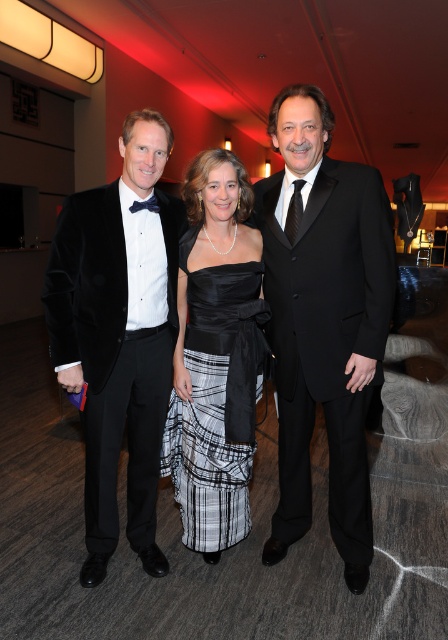
Question: Among these objects, which one is nearest to the camera?

Choices:
 (A) velvet black tuxedo at left
 (B) black satin dress at center
 (C) black velvet suit at center
 (D) velvet black tuxedo at center

Answer: (D)

Question: Where is velvet black tuxedo at center located in relation to black velvet suit at center in the image?

Choices:
 (A) above
 (B) below

Answer: (B)

Question: From the image, what is the correct spatial relationship of velvet black tuxedo at center in relation to black satin dress at center?

Choices:
 (A) below
 (B) above

Answer: (B)

Question: Which point is farther to the camera?

Choices:
 (A) black velvet suit at center
 (B) velvet black tuxedo at left

Answer: (B)

Question: Is black velvet suit at center to the right of black satin dress at center from the viewer's perspective?

Choices:
 (A) no
 (B) yes

Answer: (B)

Question: Which point appears farthest from the camera in this image?

Choices:
 (A) (352, 285)
 (B) (365, 400)
 (C) (112, 221)
 (D) (193, 493)

Answer: (D)